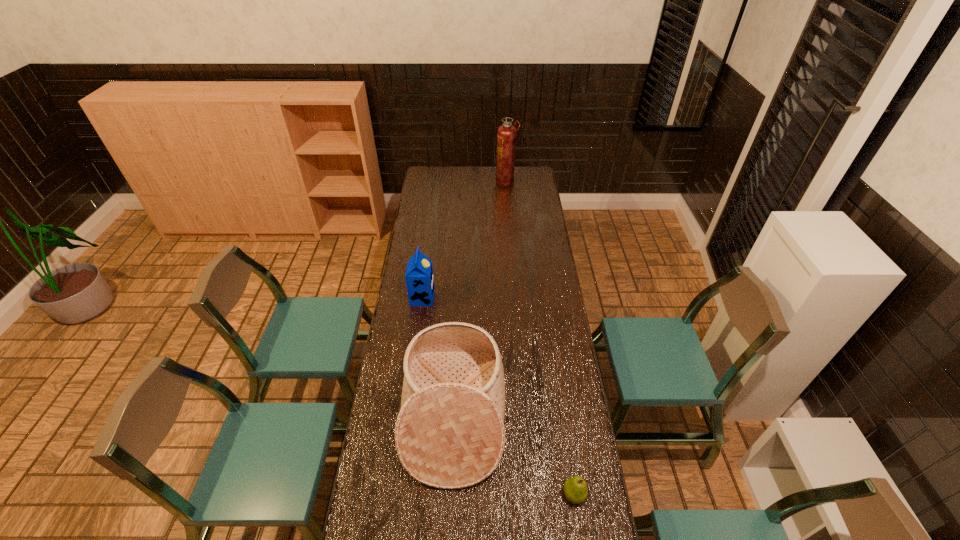
Where is `the tallest object`? This screenshot has width=960, height=540. the tallest object is located at coordinates (506, 133).

Where is `fire extinguisher`? The height and width of the screenshot is (540, 960). fire extinguisher is located at coordinates (506, 133).

Where is `basket`? basket is located at coordinates (450, 433).

The width and height of the screenshot is (960, 540). Find the location of `the third nearest object`. the third nearest object is located at coordinates (419, 278).

At what (x,y) coordinates should I click in order to perform the action: click on the rightmost object. Please return your answer as a coordinate pair (x, y). This screenshot has width=960, height=540. Looking at the image, I should click on (575, 489).

Where is `pear`? pear is located at coordinates pos(575,489).

Where is `free spot located on the side of the fire extinguisher with the label`? free spot located on the side of the fire extinguisher with the label is located at coordinates (452, 182).

Identify the location of free space located 0.190m on the side of the fire extinguisher with the label. The width and height of the screenshot is (960, 540). [466, 182].

Where is `vacant position located 0.330m on the side of the fire extinguisher with the label`? vacant position located 0.330m on the side of the fire extinguisher with the label is located at coordinates (443, 182).

This screenshot has height=540, width=960. In order to click on vacant space located 0.140m with the lid open on the basket in this screenshot , I will do `click(543, 416)`.